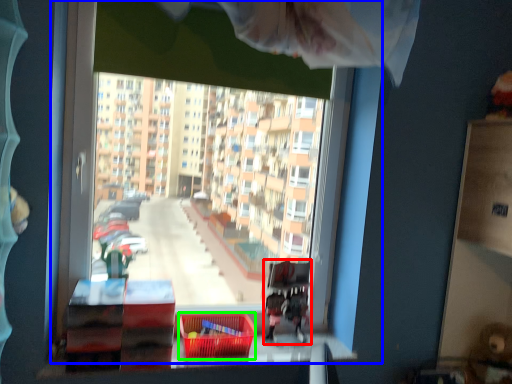
Question: Which object is the closest to the bunk bed (highlighted by a red box)? Choose among these: window (highlighted by a blue box) or basket (highlighted by a green box).

Choices:
 (A) window
 (B) basket

Answer: (B)